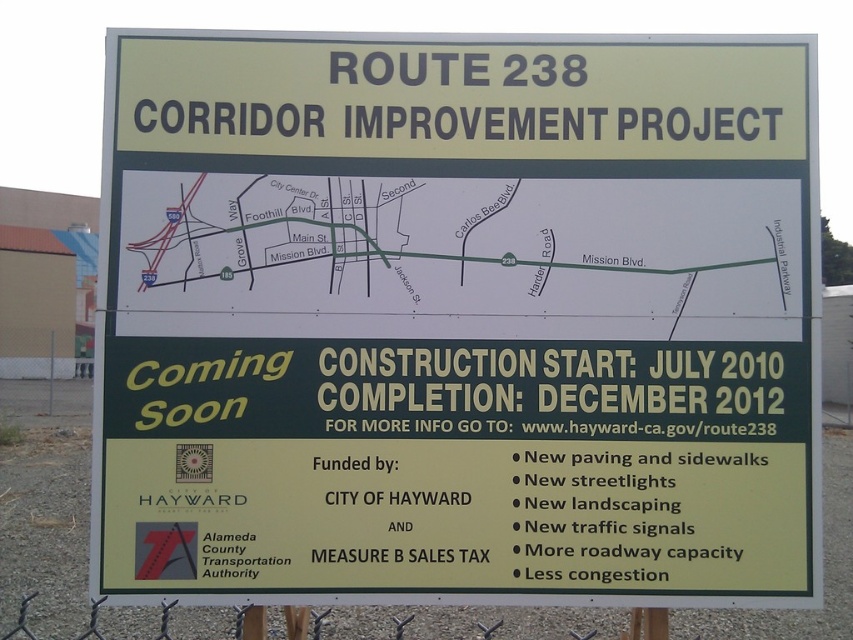
You are standing in front of the Route 238 Corridor Improvement Project signboard and want to touch both points marked on the map. Which point should you reach for first, point 1 at (648, 612) or point 2 at (57, 392)?

You should reach for point 1 at (648, 612) first because it is closer to you than point 2 at (57, 392).